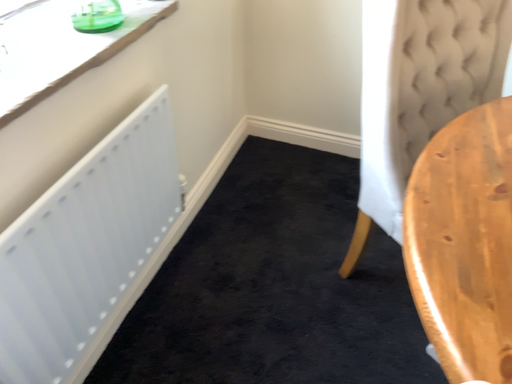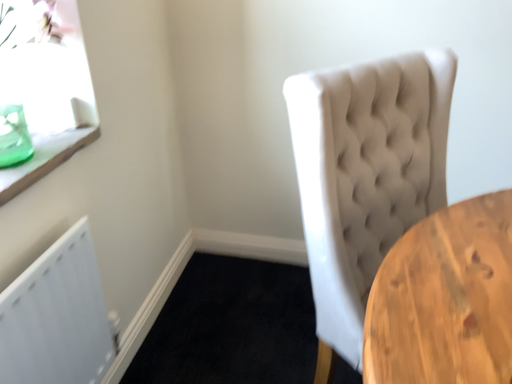
Question: How did the camera likely rotate when shooting the video?

Choices:
 (A) rotated downward
 (B) rotated upward

Answer: (B)